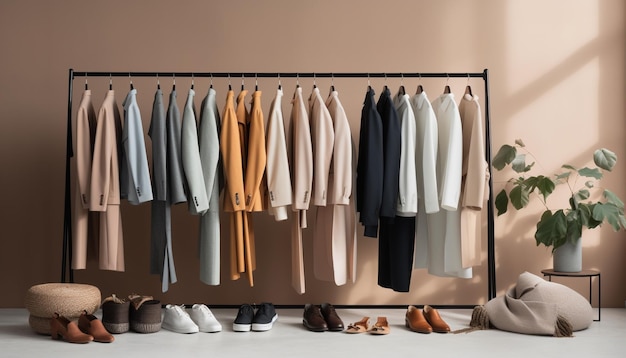
Image resolution: width=626 pixels, height=358 pixels. I want to click on buttons on sleeve cuffs, so click(x=399, y=202), click(x=322, y=193), click(x=305, y=197), click(x=270, y=195), click(x=247, y=198), click(x=237, y=196), click(x=196, y=201), click(x=139, y=191), click(x=99, y=200), click(x=84, y=198).